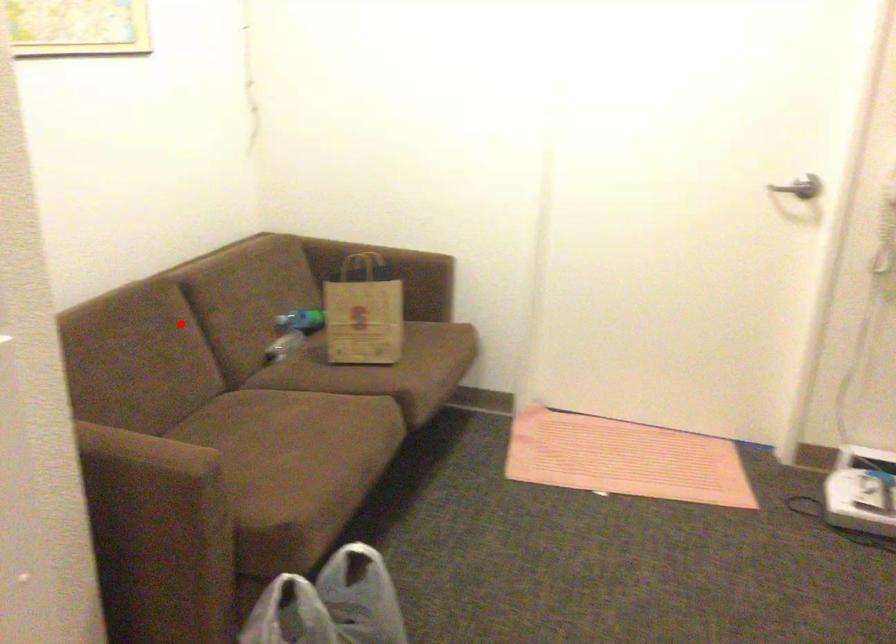
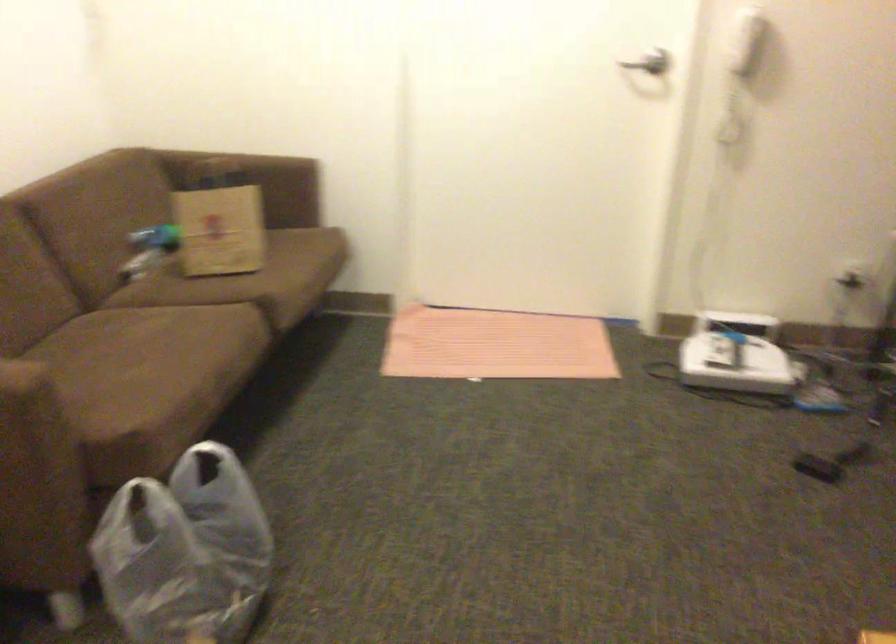
In the second image, find the point that corresponds to the highlighted location in the first image.

(23, 242)